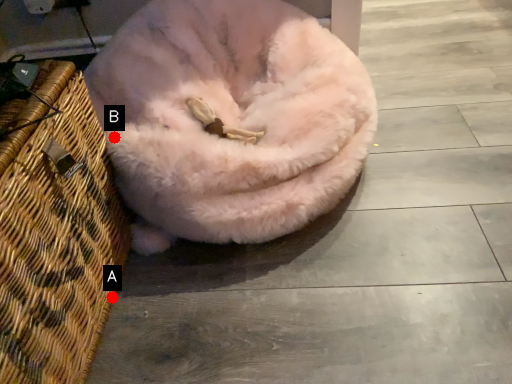
Question: Two points are circled on the image, labeled by A and B beside each circle. Among these points, which one is farthest from the camera?

Choices:
 (A) A is further
 (B) B is further

Answer: (B)